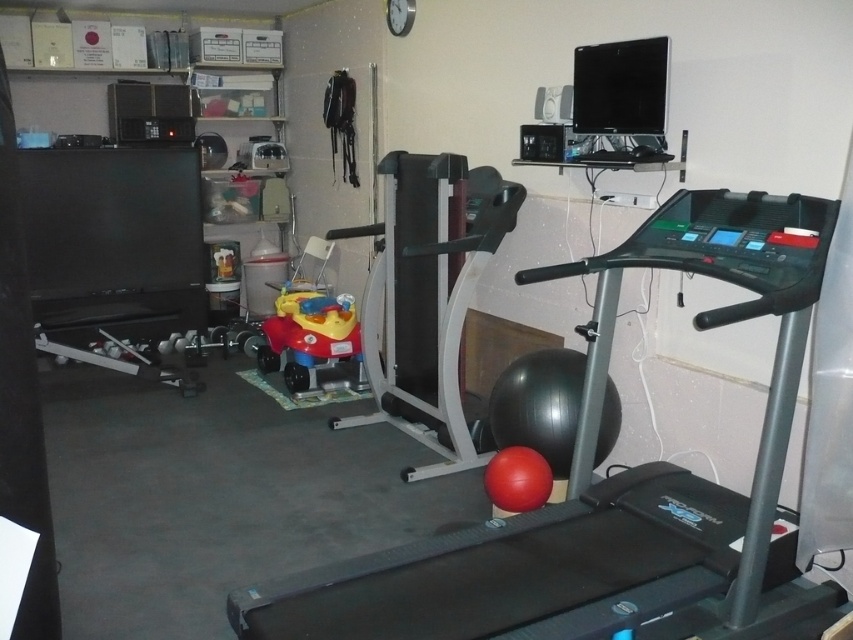
You are a fitness enthusiast who wants to place a new yoga mat between the black rubber treadmill at center and the rubberized plastic toy car at center. Which object should you position the yoga mat closer to in order to maintain the existing spatial arrangement?

The black rubber treadmill at center is closer to the viewer than the rubberized plastic toy car at center, so to maintain the existing spatial arrangement, position the yoga mat closer to the black rubber treadmill at center.

You are standing in the home gym and want to place a new piece of equipment between the two points marked as point (693,236) and point (294,380). Which point should you position the equipment closer to so that it is farther from the viewer?

You should position the equipment closer to point (294,380) because point (693,236) is closer to the viewer. Placing it near the farther point will make the equipment itself be farther from the viewer.